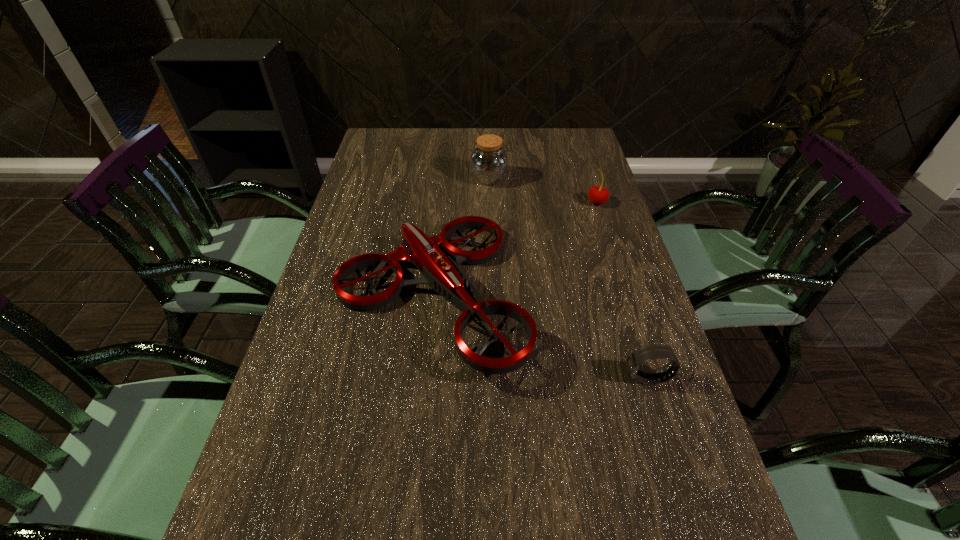
Where is `object that is positioned at the left edge`? The width and height of the screenshot is (960, 540). object that is positioned at the left edge is located at coordinates (440, 271).

At what (x,y) coordinates should I click in order to perform the action: click on cherry located at the right edge. Please return your answer as a coordinate pair (x, y). Looking at the image, I should click on (598, 195).

Where is `watch present at the right edge`? Image resolution: width=960 pixels, height=540 pixels. watch present at the right edge is located at coordinates (636, 358).

Identify the location of vacant space at the far edge of the desktop. Image resolution: width=960 pixels, height=540 pixels. (519, 151).

This screenshot has width=960, height=540. In order to click on vacant point at the left edge in this screenshot , I will do `click(297, 467)`.

The image size is (960, 540). Find the location of `free space at the right edge`. free space at the right edge is located at coordinates (589, 316).

In the image, there is a desktop. Identify the location of free region at the far right corner. (545, 130).

Locate an element on the screen. blank region between the watch and the farthest object is located at coordinates (568, 278).

You are a GUI agent. You are given a task and a screenshot of the screen. Output one action in this format:
    pyautogui.click(x=<x>, y=<y>)
    Task: Click on the vacant region between the drone and the cherry
    This screenshot has height=540, width=960.
    Given the screenshot: What is the action you would take?
    pyautogui.click(x=514, y=248)

Where is `empty location between the drone and the cherry`? This screenshot has height=540, width=960. empty location between the drone and the cherry is located at coordinates (514, 248).